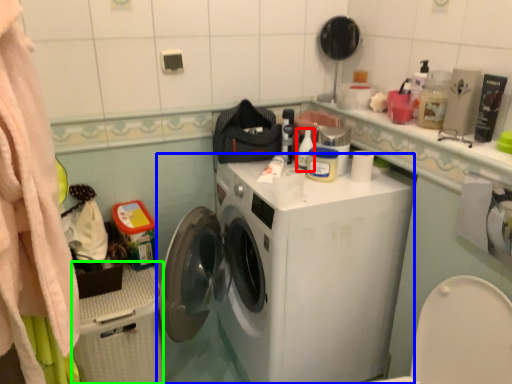
Question: Based on their relative distances, which object is farther from cleaning product (highlighted by a red box)? Choose from washing machine (highlighted by a blue box) and dish washer (highlighted by a green box).

Choices:
 (A) washing machine
 (B) dish washer

Answer: (B)